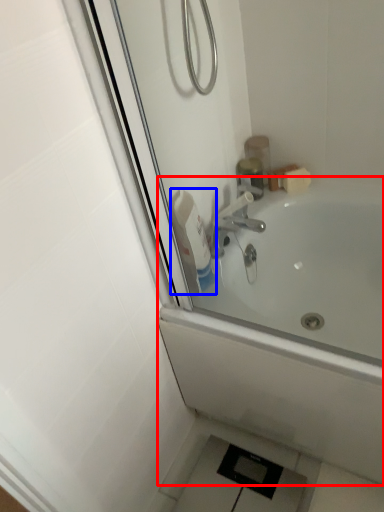
Question: Among these objects, which one is nearest to the camera, bathtub (highlighted by a red box) or cleaning product (highlighted by a blue box)?

Choices:
 (A) bathtub
 (B) cleaning product

Answer: (A)